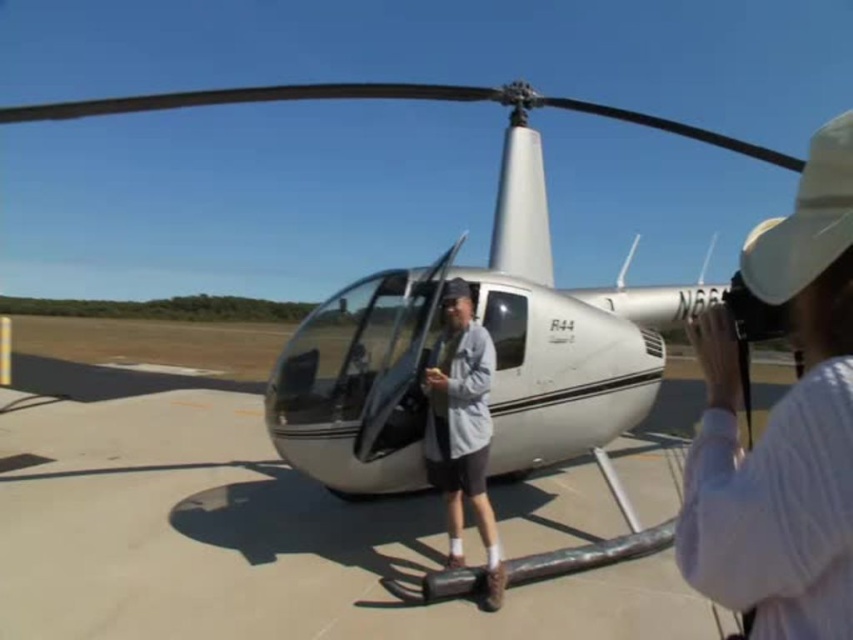
Question: Among these points, which one is farthest from the camera?

Choices:
 (A) (837, 120)
 (B) (102, 536)

Answer: (B)

Question: Which of the following is the closest to the observer?

Choices:
 (A) (746, 152)
 (B) (659, 634)

Answer: (B)

Question: Is white glossy helicopter at center behind light gray cotton shirt at center?

Choices:
 (A) no
 (B) yes

Answer: (B)

Question: From the image, what is the correct spatial relationship of white glossy helicopter at center in relation to light gray cotton shirt at center?

Choices:
 (A) below
 (B) above

Answer: (B)

Question: Which of the following is the farthest from the observer?

Choices:
 (A) white cotton hat at upper right
 (B) smooth concrete tarmac at center

Answer: (B)

Question: Is smooth concrete tarmac at center behind light gray cotton shirt at center?

Choices:
 (A) no
 (B) yes

Answer: (A)